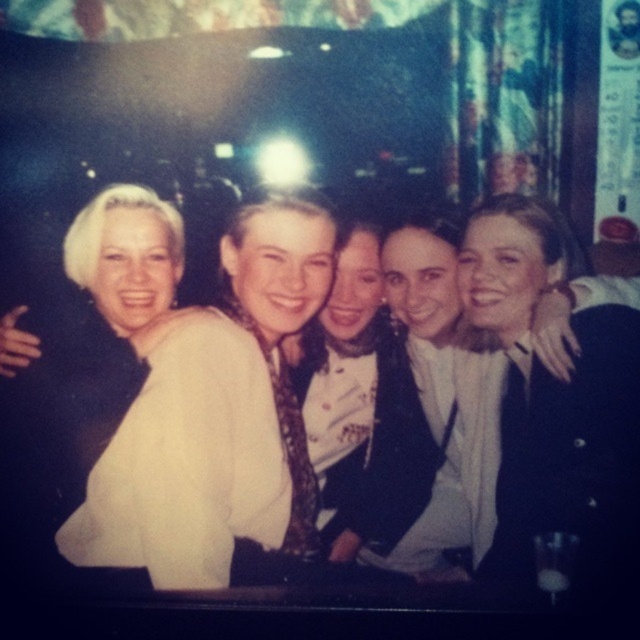
Question: Which object is closer to the camera taking this photo?

Choices:
 (A) black satin jacket at center
 (B) white satin blouse at center
 (C) blonde hair at left

Answer: (A)

Question: Which object is positioned closest to the black satin jacket at center?

Choices:
 (A) white satin blouse at center
 (B) blonde hair at left

Answer: (A)

Question: Does black satin jacket at center have a greater width compared to blonde hair at left?

Choices:
 (A) no
 (B) yes

Answer: (A)

Question: Can you confirm if black satin jacket at center is positioned to the right of blonde hair at left?

Choices:
 (A) no
 (B) yes

Answer: (B)

Question: Considering the relative positions of white satin blouse at center and blonde hair at left in the image provided, where is white satin blouse at center located with respect to blonde hair at left?

Choices:
 (A) below
 (B) above

Answer: (A)

Question: Which of the following is the farthest from the observer?

Choices:
 (A) (522, 540)
 (B) (113, 456)
 (C) (106, 440)

Answer: (C)